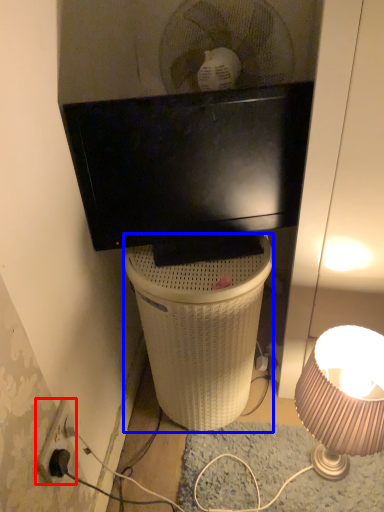
Question: Which object appears farthest to the camera in this image, power outlet (highlighted by a red box) or trash bin/can (highlighted by a blue box)?

Choices:
 (A) power outlet
 (B) trash bin/can

Answer: (B)